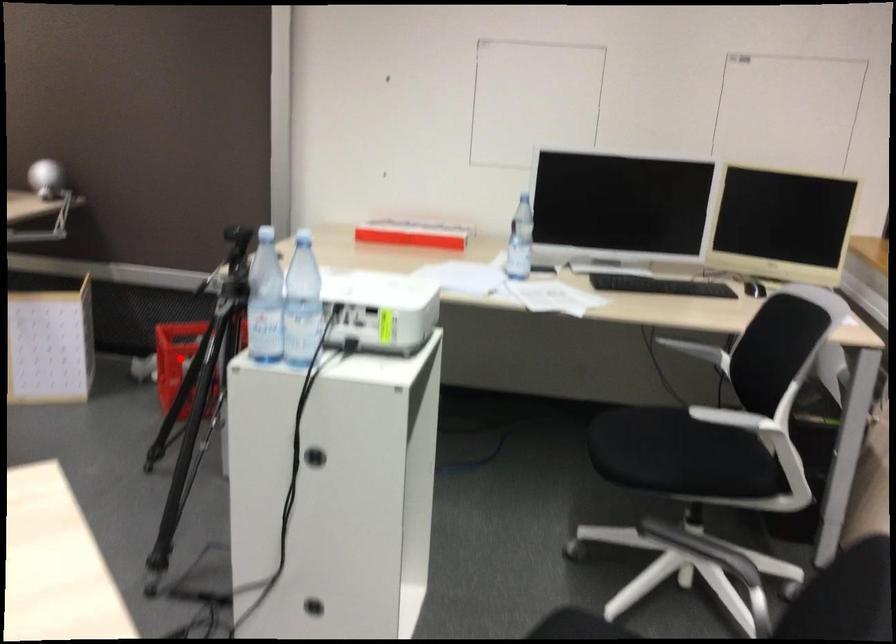
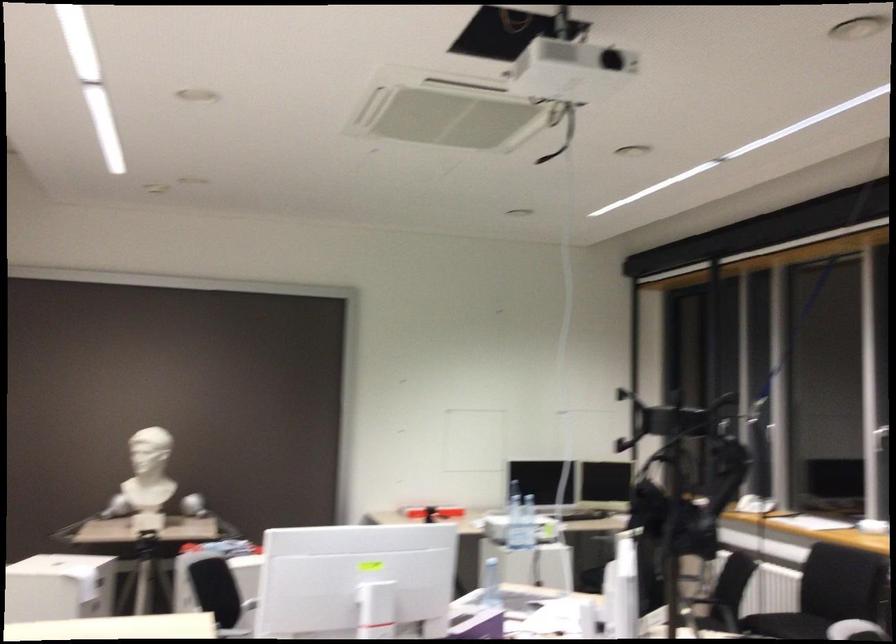
Question: I am providing you with two images of the same scene from different viewpoints. A red point is marked on the first image. At the location where the point appears in image 1, is it still visible in image 2?

Choices:
 (A) Yes
 (B) No

Answer: (B)